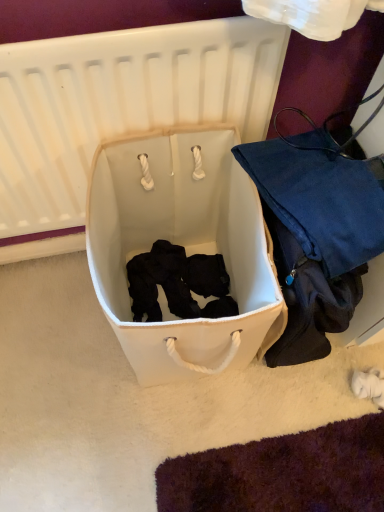
The height and width of the screenshot is (512, 384). In order to click on white fabric laundry basket at center in this screenshot , I will do `click(185, 249)`.

Identify the location of white fabric infant bed at center. The width and height of the screenshot is (384, 512). (121, 103).

What is the approximate height of matte blue fabric bag at right?

It is 21.82 inches.

Where is `white fabric laundry basket at center`? This screenshot has height=512, width=384. white fabric laundry basket at center is located at coordinates (185, 249).

Is white fabric infant bed at center placed right next to matte blue fabric bag at right?

No, white fabric infant bed at center is not with matte blue fabric bag at right.

Is the position of white fabric infant bed at center more distant than that of matte blue fabric bag at right?

No, white fabric infant bed at center is in front of matte blue fabric bag at right.

From the image's perspective, which object appears higher, white fabric infant bed at center or matte blue fabric bag at right?

white fabric infant bed at center is shown above in the image.

Is white fabric infant bed at center positioned with its back to matte blue fabric bag at right?

white fabric infant bed at center does not have its back to matte blue fabric bag at right.

From the image's perspective, is white fabric laundry basket at center on matte blue fabric bag at right?

No, from the image's perspective, white fabric laundry basket at center is not over matte blue fabric bag at right.

Could you tell me if white fabric laundry basket at center is turned towards matte blue fabric bag at right?

No, white fabric laundry basket at center is not turned towards matte blue fabric bag at right.

In terms of size, does white fabric laundry basket at center appear bigger or smaller than matte blue fabric bag at right?

white fabric laundry basket at center is bigger than matte blue fabric bag at right.

From a real-world perspective, which is physically below, white fabric laundry basket at center or matte blue fabric bag at right?

In real-world perspective, white fabric laundry basket at center is lower.

Is matte blue fabric bag at right facing away from white fabric laundry basket at center?

That's not correct — matte blue fabric bag at right is not looking away from white fabric laundry basket at center.

Is matte blue fabric bag at right far from white fabric laundry basket at center?

That's not correct — matte blue fabric bag at right is a little close to white fabric laundry basket at center.

In the image, there is a matte blue fabric bag at right. At what (x,y) coordinates should I click in order to perform the action: click on storage box below it (from the image's perspective). Please return your answer as a coordinate pair (x, y). This screenshot has height=512, width=384. Looking at the image, I should click on (185, 249).

Looking at their sizes, would you say matte blue fabric bag at right is wider or thinner than white fabric laundry basket at center?

Clearly, matte blue fabric bag at right has less width compared to white fabric laundry basket at center.

Is white fabric infant bed at center beside white fabric laundry basket at center?

white fabric infant bed at center is not next to white fabric laundry basket at center, and they're not touching.

In the scene shown: From the image's perspective, between white fabric infant bed at center and white fabric laundry basket at center, who is located below?

white fabric laundry basket at center appears lower in the image.

Does white fabric infant bed at center lie behind white fabric laundry basket at center?

No, white fabric infant bed at center is in front of white fabric laundry basket at center.

Considering the relative sizes of matte blue fabric bag at right and white fabric infant bed at center in the image provided, is matte blue fabric bag at right taller than white fabric infant bed at center?

No.

Which object is further away from the camera, matte blue fabric bag at right or white fabric infant bed at center?

matte blue fabric bag at right is behind.

Is white fabric infant bed at center at the back of matte blue fabric bag at right?

Yes, matte blue fabric bag at right is facing away from white fabric infant bed at center.

Is white fabric laundry basket at center positioned with its back to white fabric infant bed at center?

That's right, white fabric laundry basket at center is facing away from white fabric infant bed at center.

In terms of width, does white fabric laundry basket at center look wider or thinner when compared to white fabric infant bed at center?

In the image, white fabric laundry basket at center appears to be wider than white fabric infant bed at center.

From the image's perspective, does white fabric laundry basket at center appear lower than white fabric infant bed at center?

Indeed, from the image's perspective, white fabric laundry basket at center is shown beneath white fabric infant bed at center.

I want to click on infant bed in front of the matte blue fabric bag at right, so click(121, 103).

This screenshot has height=512, width=384. In order to click on luggage and bags above the white fabric laundry basket at center (from a real-world perspective) in this screenshot , I will do `click(316, 233)`.

When comparing their distances from matte blue fabric bag at right, does white fabric infant bed at center or white fabric laundry basket at center seem further?

white fabric infant bed at center lies further to matte blue fabric bag at right than the other object.

Based on their spatial positions, is white fabric infant bed at center or matte blue fabric bag at right further from white fabric laundry basket at center?

white fabric infant bed at center is positioned further to the anchor white fabric laundry basket at center.

Based on their spatial positions, is white fabric laundry basket at center or white fabric infant bed at center further from matte blue fabric bag at right?

white fabric infant bed at center is further to matte blue fabric bag at right.

Looking at this image, estimate the real-world distances between objects in this image. Which object is closer to white fabric infant bed at center, white fabric laundry basket at center or matte blue fabric bag at right?

white fabric laundry basket at center.

From the image, which object appears to be farther from white fabric infant bed at center, matte blue fabric bag at right or white fabric laundry basket at center?

matte blue fabric bag at right is further to white fabric infant bed at center.

Which object lies further to the anchor point white fabric laundry basket at center, matte blue fabric bag at right or white fabric infant bed at center?

The object further to white fabric laundry basket at center is white fabric infant bed at center.

Identify the location of storage box between white fabric infant bed at center and matte blue fabric bag at right from left to right. This screenshot has height=512, width=384. (185, 249).